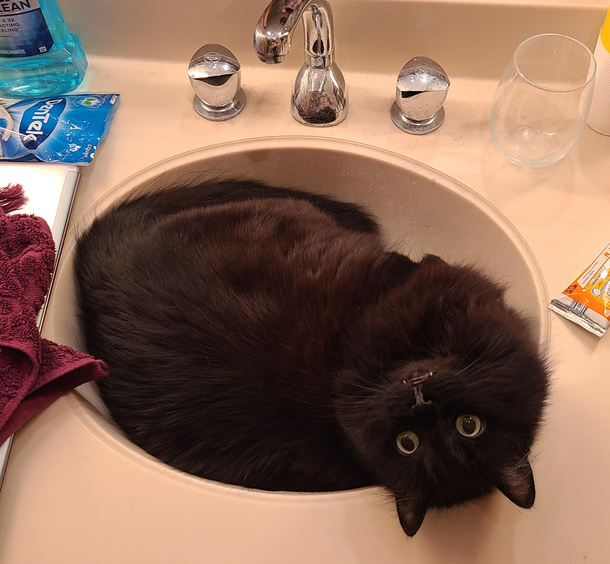
At what (x,y) coordinates should I click in order to perform the action: click on towel. Please return your answer as a coordinate pair (x, y). This screenshot has width=610, height=564. Looking at the image, I should click on (30, 261), (9, 339).